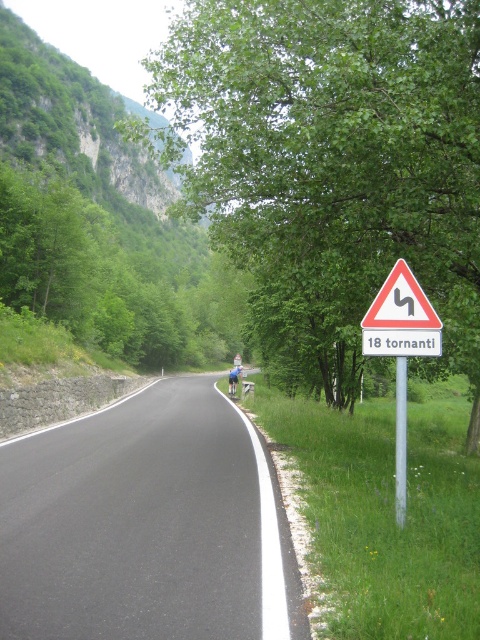
Does black asphalt road at center appear on the right side of white plastic triangle at center-right?

In fact, black asphalt road at center is to the left of white plastic triangle at center-right.

Can you confirm if black asphalt road at center is positioned above white plastic triangle at center-right?

Incorrect, black asphalt road at center is not positioned above white plastic triangle at center-right.

Who is more distant from viewer, (203, 580) or (408, 273)?

The point (408, 273) is more distant.

What are the coordinates of `black asphalt road at center` in the screenshot? It's located at (147, 524).

Which is more to the left, white triangular sign with black curved arrow at right or blue fabric motorcyclist at center?

Positioned to the left is blue fabric motorcyclist at center.

Does white triangular sign with black curved arrow at right have a lesser width compared to blue fabric motorcyclist at center?

No, white triangular sign with black curved arrow at right is not thinner than blue fabric motorcyclist at center.

Is point (407, 298) closer to viewer compared to point (233, 387)?

Yes, point (407, 298) is closer to viewer.

Locate an element on the screen. white triangular sign with black curved arrow at right is located at coordinates (400, 349).

Does black asphalt road at center have a lesser width compared to blue fabric motorcyclist at center?

Incorrect, black asphalt road at center's width is not less than blue fabric motorcyclist at center's.

The image size is (480, 640). I want to click on black asphalt road at center, so coord(147,524).

This screenshot has height=640, width=480. Find the location of `black asphalt road at center`. black asphalt road at center is located at coordinates (147, 524).